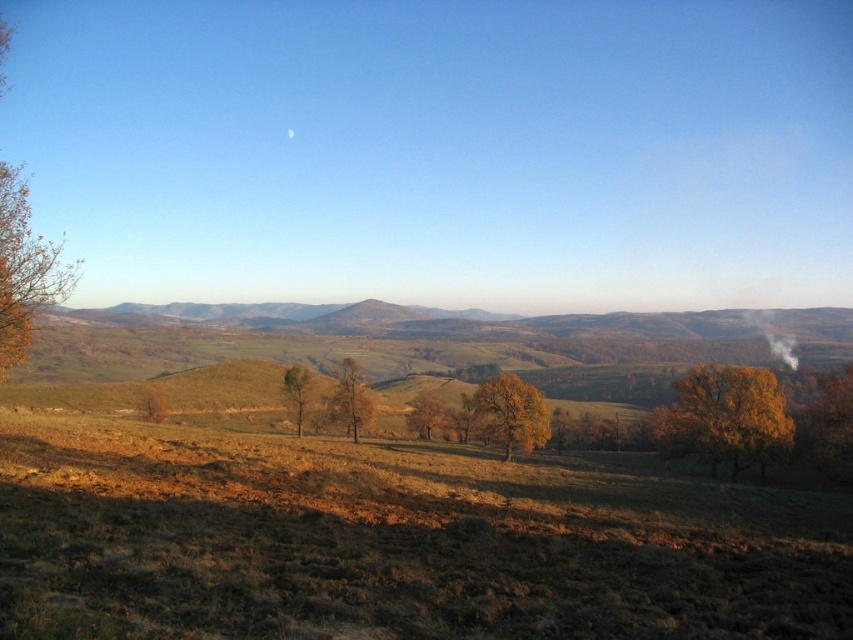
Question: Which object is closer to the camera taking this photo?

Choices:
 (A) yellow matte tree at center
 (B) brown grassland at center
 (C) yellow leafy tree at right
 (D) green leafy tree at center

Answer: (B)

Question: Is golden leafy tree at center smaller than yellow matte tree at center?

Choices:
 (A) no
 (B) yes

Answer: (A)

Question: Which of the following is the closest to the observer?

Choices:
 (A) yellow leafy tree at right
 (B) golden leafy tree at left

Answer: (B)

Question: Can you confirm if golden leafy tree at left is positioned to the left of yellow matte tree at center?

Choices:
 (A) yes
 (B) no

Answer: (A)

Question: Which object appears farthest from the camera in this image?

Choices:
 (A) golden leafy tree at left
 (B) green leafy tree at center
 (C) yellow matte tree at center
 (D) brown matte tree at center

Answer: (C)

Question: Is golden leafy tree at center in front of brown matte tree at center?

Choices:
 (A) yes
 (B) no

Answer: (A)